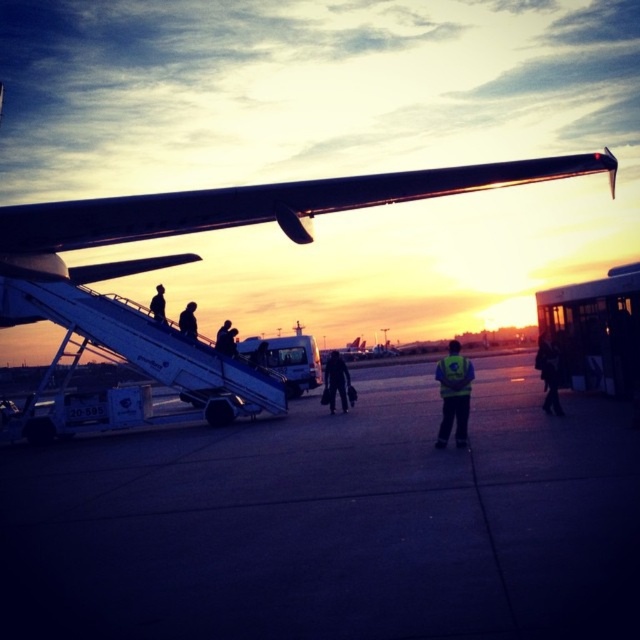
Consider the image. You are a passenger at the airport and want to board the plane through the mobile staircase. The metallic silver wing at upper center is in your line of sight. How does its size compare to the dark blue jeans at center?

The metallic silver wing at upper center is wider than the dark blue jeans at center.

From the picture: You are a security guard at the airport and need to identify which object is bigger between the dark blue jeans at center and the silhouette figure at upper left. Based on the scene, which one should you report as larger?

The dark blue jeans at center is larger in size than the silhouette figure at upper left, so you should report the dark blue jeans at center as the larger one.

You are standing at the airport tarmac and want to reach the point closer to you. Which point should you head towards, point (339,380) or point (192,321)?

You should head towards point (192,321) because point (339,380) is further away from you compared to point (192,321).